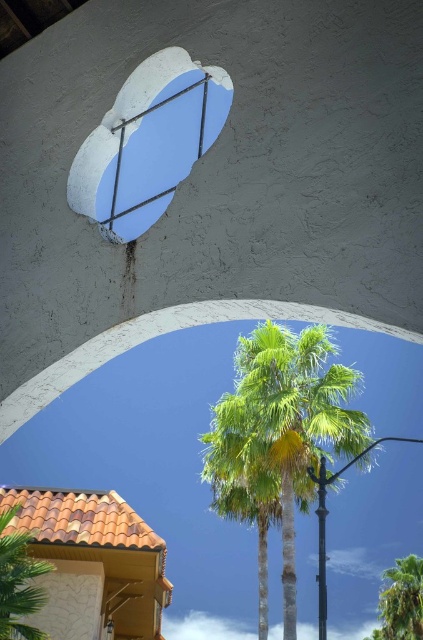
Question: Which object is farther from the camera taking this photo?

Choices:
 (A) green leafy palm tree at lower right
 (B) white concrete archway at center
 (C) green leafy palm at lower left

Answer: (A)

Question: Which of the following is the closest to the observer?

Choices:
 (A) white concrete window at upper center
 (B) green leafy palm tree at center
 (C) green leafy palm tree at lower right

Answer: (A)

Question: Considering the relative positions of white concrete window at upper center and green leafy palm tree at lower right in the image provided, where is white concrete window at upper center located with respect to green leafy palm tree at lower right?

Choices:
 (A) above
 (B) below

Answer: (A)

Question: Which of the following is the farthest from the observer?

Choices:
 (A) click(x=22, y=589)
 (B) click(x=412, y=490)
 (C) click(x=331, y=340)
 (D) click(x=422, y=625)

Answer: (B)

Question: From the image, what is the correct spatial relationship of green leafy palm tree at center in relation to green leafy palm tree at lower right?

Choices:
 (A) above
 (B) below

Answer: (A)

Question: Where is green leafy palm tree at center located in relation to green leafy palm at lower left in the image?

Choices:
 (A) left
 (B) right

Answer: (B)